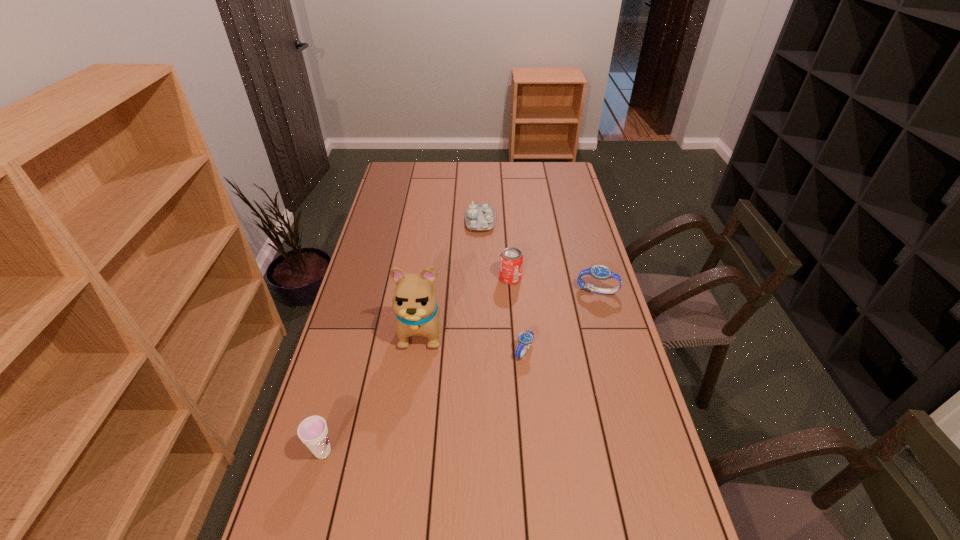
Locate an element on the screen. The height and width of the screenshot is (540, 960). cup is located at coordinates (313, 432).

At what (x,y) coordinates should I click in order to perform the action: click on vacant area situated on the front of the nearer watch. Please return your answer as a coordinate pair (x, y). This screenshot has width=960, height=540. Looking at the image, I should click on (533, 444).

Where is `free space located 0.360m on the back of the farther watch`? The width and height of the screenshot is (960, 540). free space located 0.360m on the back of the farther watch is located at coordinates (579, 226).

The height and width of the screenshot is (540, 960). Identify the location of free space located 0.300m on the front of the can. (516, 351).

Image resolution: width=960 pixels, height=540 pixels. Find the location of `free space located 0.370m on the front of the second shortest object`. free space located 0.370m on the front of the second shortest object is located at coordinates (480, 296).

I want to click on free region located 0.100m on the face of the second object from left to right, so tap(415, 384).

At what (x,y) coordinates should I click in order to perform the action: click on vacant space situated 0.340m on the back of the leftmost object. Please return your answer as a coordinate pair (x, y). This screenshot has height=540, width=960. Looking at the image, I should click on (354, 340).

Locate an element on the screen. The height and width of the screenshot is (540, 960). object that is at the left edge is located at coordinates click(x=313, y=432).

This screenshot has width=960, height=540. Find the location of `object that is at the right edge`. object that is at the right edge is located at coordinates (599, 272).

Find the location of a particular element. free region at the far edge is located at coordinates (469, 169).